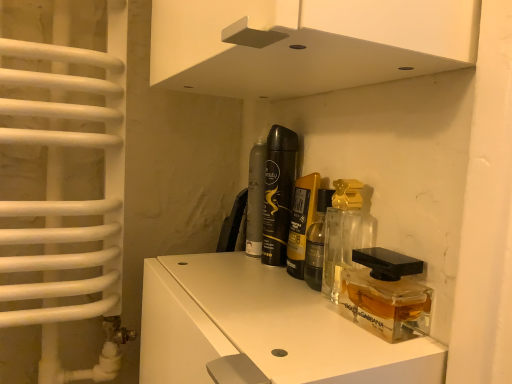
Where is `free space to the left of transparent plastic perfume bottle at center`? Image resolution: width=512 pixels, height=384 pixels. free space to the left of transparent plastic perfume bottle at center is located at coordinates (262, 312).